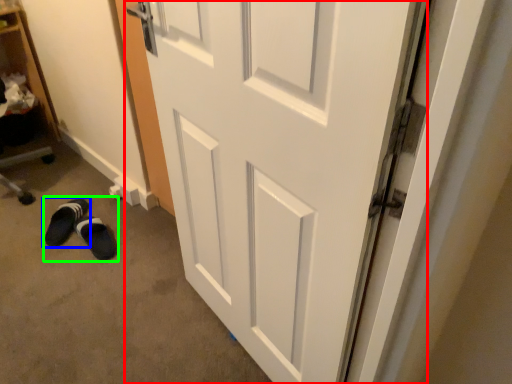
Question: Estimate the real-world distances between objects in this image. Which object is farther from door (highlighted by a red box), footwear (highlighted by a blue box) or shoe (highlighted by a green box)?

Choices:
 (A) footwear
 (B) shoe

Answer: (A)